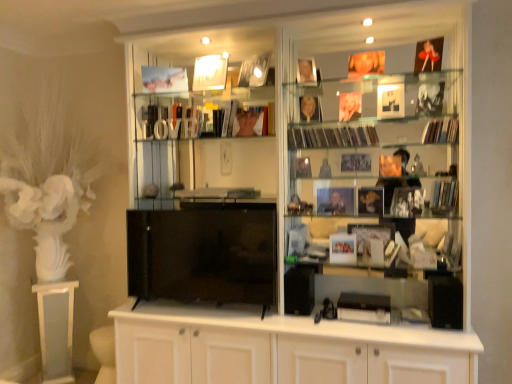
Question: Is matte black book at right, which appears as the 4th magazine when viewed from the top, positioned before shiny plastic magazines at center right, which is counted as the fourth magazine, starting from the bottom?

Choices:
 (A) no
 (B) yes

Answer: (B)

Question: Is matte black book at right, the second magazine positioned from the bottom, wider than shiny plastic magazines at center right, which is counted as the fourth magazine, starting from the bottom?

Choices:
 (A) no
 (B) yes

Answer: (B)

Question: Can shiny plastic magazines at center right, which is counted as the fourth magazine, starting from the bottom, be found inside matte black book at right, the second magazine positioned from the bottom?

Choices:
 (A) yes
 (B) no

Answer: (B)

Question: From the image's perspective, does matte black book at right, the second magazine positioned from the bottom, appear higher than shiny plastic magazines at center right, which is counted as the fourth magazine, starting from the bottom?

Choices:
 (A) yes
 (B) no

Answer: (B)

Question: Is matte black book at right, which appears as the 4th magazine when viewed from the top, taller than shiny plastic magazines at center right, arranged as the 2th magazine when viewed from the top?

Choices:
 (A) yes
 (B) no

Answer: (A)

Question: From a real-world perspective, is matte black book at right, the second magazine positioned from the bottom, on shiny plastic magazines at center right, arranged as the 2th magazine when viewed from the top?

Choices:
 (A) no
 (B) yes

Answer: (A)

Question: Can you confirm if matte paper magazine at center, which appears as the 3th magazine when ordered from the bottom, is bigger than matte white photo frame at center, the first book when ordered from bottom to top?

Choices:
 (A) yes
 (B) no

Answer: (B)

Question: Would you say matte paper magazine at center, the third magazine positioned from the top, is outside matte white photo frame at center, the 2th book from the top?

Choices:
 (A) yes
 (B) no

Answer: (A)

Question: Is matte paper magazine at center, which appears as the 3th magazine when ordered from the bottom, behind matte white photo frame at center, the second book viewed from the back?

Choices:
 (A) no
 (B) yes

Answer: (B)

Question: Does matte paper magazine at center, which appears as the 3th magazine when ordered from the bottom, have a smaller size compared to matte white photo frame at center, which ranks as the 1th book in front-to-back order?

Choices:
 (A) no
 (B) yes

Answer: (B)

Question: Is matte paper magazine at center, which appears as the 3th magazine when ordered from the bottom, wider than matte white photo frame at center, which ranks as the 1th book in front-to-back order?

Choices:
 (A) no
 (B) yes

Answer: (A)

Question: Does matte paper magazine at center, the third magazine positioned from the top, lie in front of matte white photo frame at center, acting as the 2th book starting from the left?

Choices:
 (A) yes
 (B) no

Answer: (B)

Question: Can matte gold photo frame at upper center, the 1th book when ordered from top to bottom, be found inside black glossy tv at center?

Choices:
 (A) yes
 (B) no

Answer: (B)